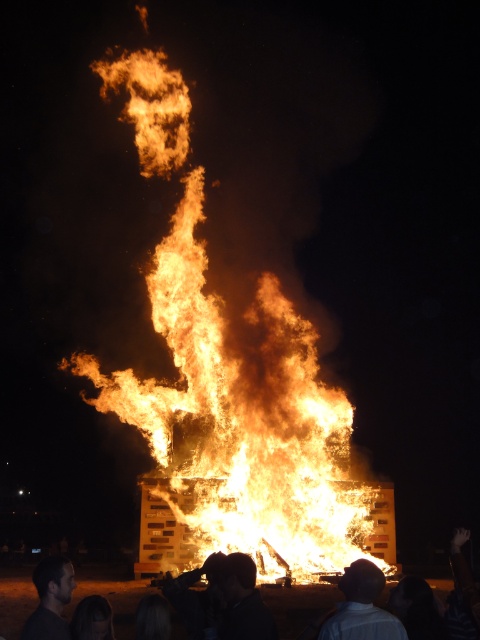
Question: Is dark hair at lower center below dark hair at lower left?

Choices:
 (A) no
 (B) yes

Answer: (A)

Question: Which point is farther to the camera?

Choices:
 (A) dark hair at lower center
 (B) white cotton shirt at lower center
 (C) flaming wood at center

Answer: (C)

Question: Which object is farther from the camera taking this photo?

Choices:
 (A) dark hair at lower center
 (B) white cotton shirt at lower center
 (C) flaming wood at center

Answer: (C)

Question: From the image, what is the correct spatial relationship of white cotton shirt at lower center in relation to dark clothing crowd at lower center?

Choices:
 (A) above
 (B) below

Answer: (A)

Question: Does dark hair at lower left have a lesser width compared to dark clothing crowd at lower center?

Choices:
 (A) no
 (B) yes

Answer: (B)

Question: Among these points, which one is nearest to the camera?

Choices:
 (A) (192, 541)
 (B) (389, 628)

Answer: (B)